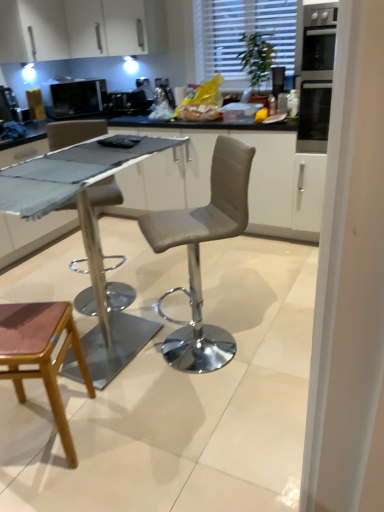
Question: Is satin black coffee machine at center, the 1th appliance from the right, looking in the opposite direction of black glass oven at upper right?

Choices:
 (A) yes
 (B) no

Answer: (B)

Question: Is satin black coffee machine at center, the 1th appliance from the right, smaller than black glass oven at upper right?

Choices:
 (A) yes
 (B) no

Answer: (A)

Question: Is satin black coffee machine at center, the 1th appliance from the right, at the right side of black glass oven at upper right?

Choices:
 (A) no
 (B) yes

Answer: (A)

Question: From a real-world perspective, is satin black coffee machine at center, the 2th appliance positioned from the left, physically above black glass oven at upper right?

Choices:
 (A) no
 (B) yes

Answer: (A)

Question: Does satin black coffee machine at center, the 2th appliance positioned from the left, have a greater height compared to black glass oven at upper right?

Choices:
 (A) no
 (B) yes

Answer: (A)

Question: Can black glass oven at upper right be found inside satin black coffee machine at center, the 1th appliance from the right?

Choices:
 (A) yes
 (B) no

Answer: (B)

Question: Can you confirm if white textured blinds at upper center is positioned to the left of satin black coffee machine at center, the 1th appliance from the right?

Choices:
 (A) yes
 (B) no

Answer: (B)

Question: Is white textured blinds at upper center next to satin black coffee machine at center, the 1th appliance from the right, and touching it?

Choices:
 (A) no
 (B) yes

Answer: (A)

Question: Is white textured blinds at upper center further to the viewer compared to satin black coffee machine at center, the 1th appliance from the right?

Choices:
 (A) yes
 (B) no

Answer: (B)

Question: Can you confirm if white textured blinds at upper center is shorter than satin black coffee machine at center, the 1th appliance from the right?

Choices:
 (A) no
 (B) yes

Answer: (A)

Question: From a real-world perspective, does white textured blinds at upper center sit lower than satin black coffee machine at center, the 2th appliance positioned from the left?

Choices:
 (A) yes
 (B) no

Answer: (B)

Question: From the image's perspective, does white textured blinds at upper center appear higher than satin black coffee machine at center, the 2th appliance positioned from the left?

Choices:
 (A) yes
 (B) no

Answer: (A)

Question: Is white textured blinds at upper center shorter than white glossy cabinet at upper left?

Choices:
 (A) no
 (B) yes

Answer: (A)